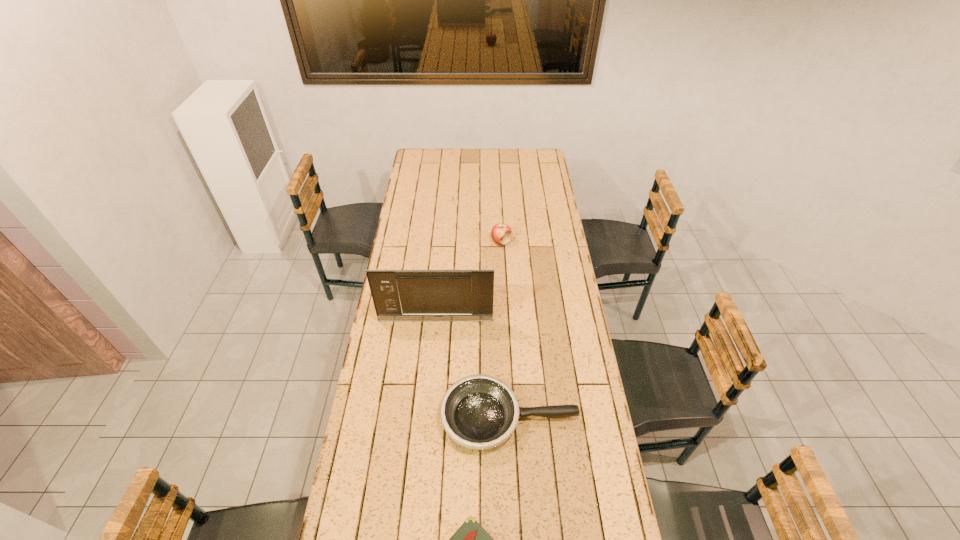
Where is `blank space at the far edge of the desktop`? The image size is (960, 540). blank space at the far edge of the desktop is located at coordinates (483, 164).

In the image, there is a desktop. Where is `vacant space at the left edge`? This screenshot has height=540, width=960. vacant space at the left edge is located at coordinates (434, 201).

You are a GUI agent. You are given a task and a screenshot of the screen. Output one action in this format:
    pyautogui.click(x=<x>, y=<y>)
    Task: Click on the vacant space at the right edge of the desktop
    The height and width of the screenshot is (540, 960).
    Given the screenshot: What is the action you would take?
    (576, 319)

This screenshot has width=960, height=540. In order to click on blank region between the third shortest object and the frying pan in this screenshot , I will do `click(505, 329)`.

Point out which object is positioned as the third nearest to the nearest object. Please provide its 2D coordinates. Your answer should be formatted as a tuple, i.e. [(x, y)], where the tuple contains the x and y coordinates of a point satisfying the conditions above.

[(501, 233)]

You are a GUI agent. You are given a task and a screenshot of the screen. Output one action in this format:
    pyautogui.click(x=<x>, y=<y>)
    Task: Click on the object that ranks as the second closest to the farthest object
    The image size is (960, 540).
    Given the screenshot: What is the action you would take?
    pyautogui.click(x=479, y=412)